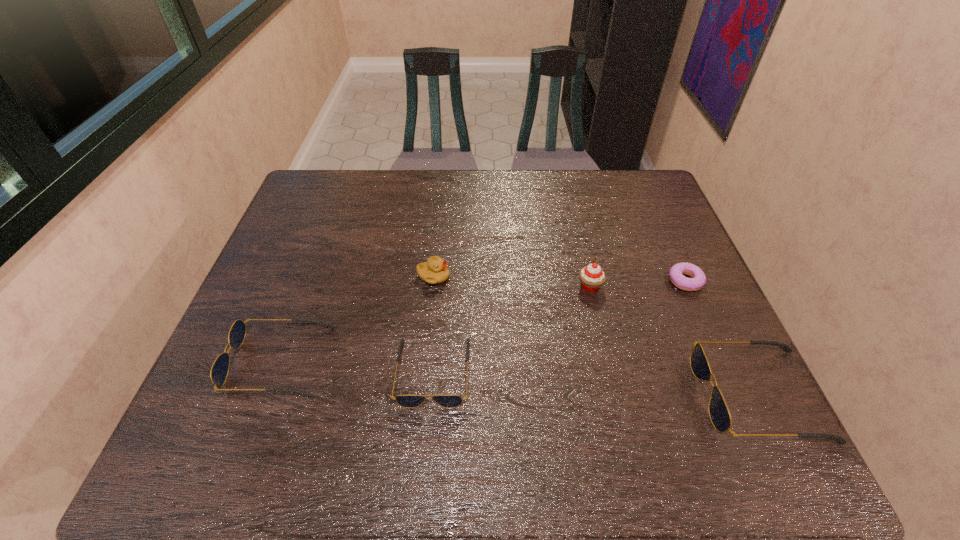
Image resolution: width=960 pixels, height=540 pixels. I want to click on free spot between the second sunglasses from left to right and the duckling, so click(x=433, y=325).

Where is `free point between the rightmost sunglasses and the duckling`? free point between the rightmost sunglasses and the duckling is located at coordinates (596, 336).

Locate an element on the screen. vacant space that is in between the duckling and the rightmost sunglasses is located at coordinates (596, 336).

Locate an element on the screen. The height and width of the screenshot is (540, 960). unoccupied position between the duckling and the rightmost sunglasses is located at coordinates (596, 336).

Where is `vacant point located between the duckling and the rightmost sunglasses`? This screenshot has width=960, height=540. vacant point located between the duckling and the rightmost sunglasses is located at coordinates (596, 336).

Find the location of a particular element. The height and width of the screenshot is (540, 960). free space between the cupcake and the doughnut is located at coordinates (637, 284).

Where is `object that is the fifth closest to the duckling`? The height and width of the screenshot is (540, 960). object that is the fifth closest to the duckling is located at coordinates (719, 413).

Locate which object ranks in proximity to the rightmost sunglasses. Please provide its 2D coordinates. Your answer should be formatted as a tuple, i.e. [(x, y)], where the tuple contains the x and y coordinates of a point satisfying the conditions above.

[(698, 279)]

Select which sunglasses appears as the second closest to the rightmost sunglasses. Please provide its 2D coordinates. Your answer should be formatted as a tuple, i.e. [(x, y)], where the tuple contains the x and y coordinates of a point satisfying the conditions above.

[(219, 371)]

This screenshot has height=540, width=960. Identify the location of sunglasses that is the third closest to the duckling. (719, 413).